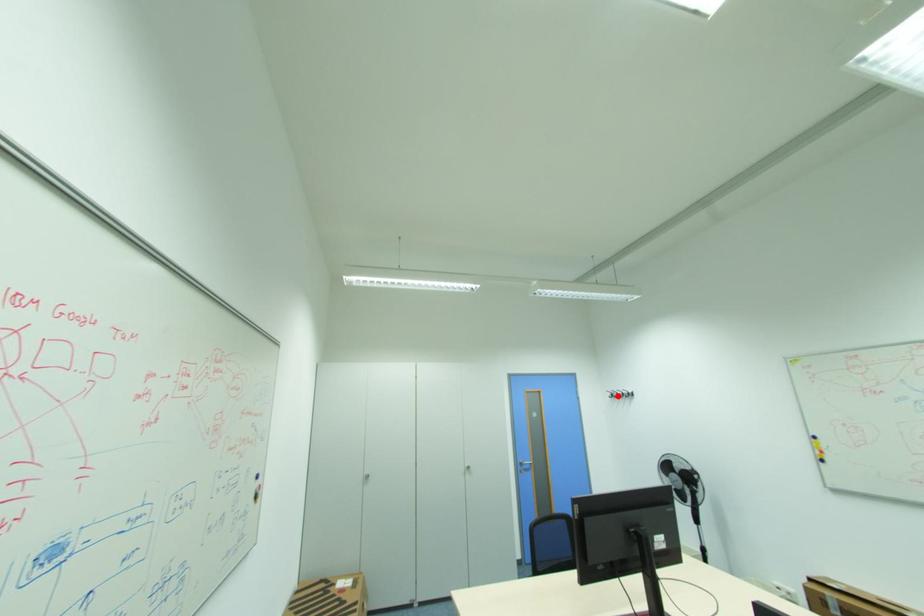
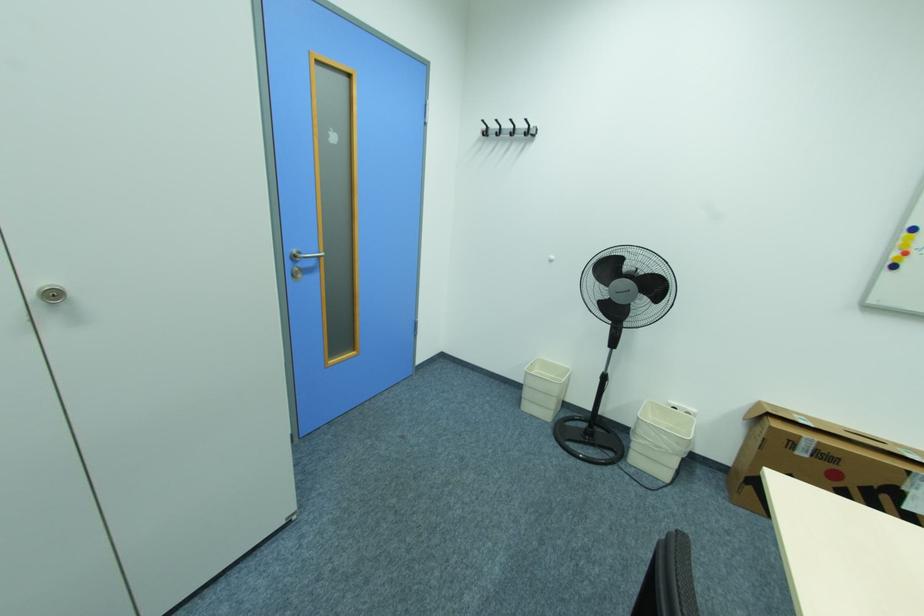
The point at the highlighted location is marked in the first image. Where is the corresponding point in the second image?

(492, 132)